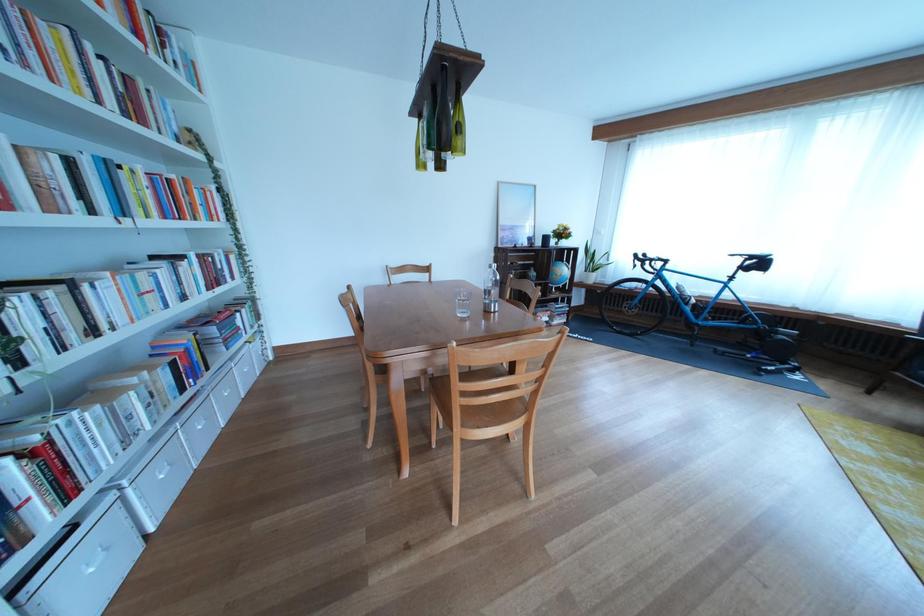
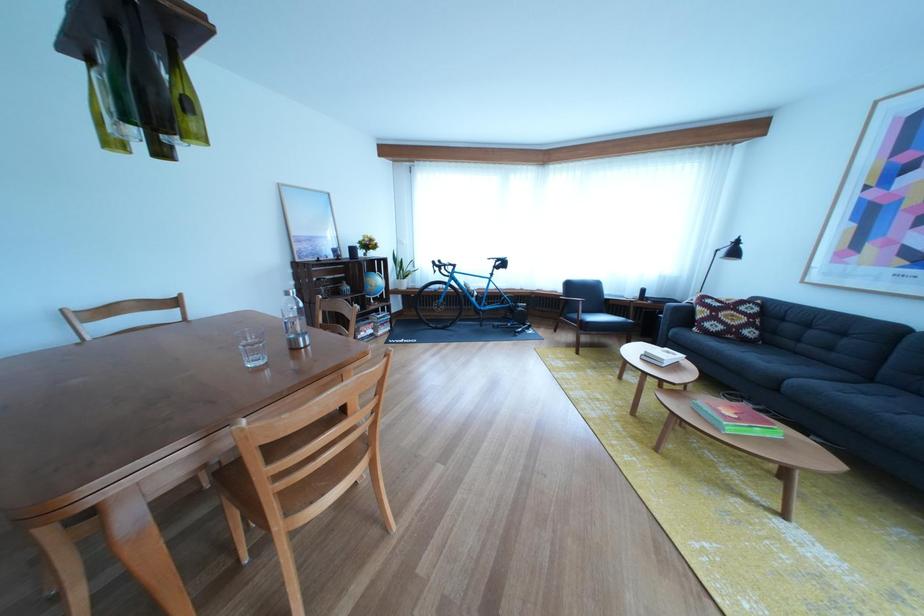
Question: How did the camera likely rotate?

Choices:
 (A) Left
 (B) Right
 (C) Up
 (D) Down

Answer: (B)